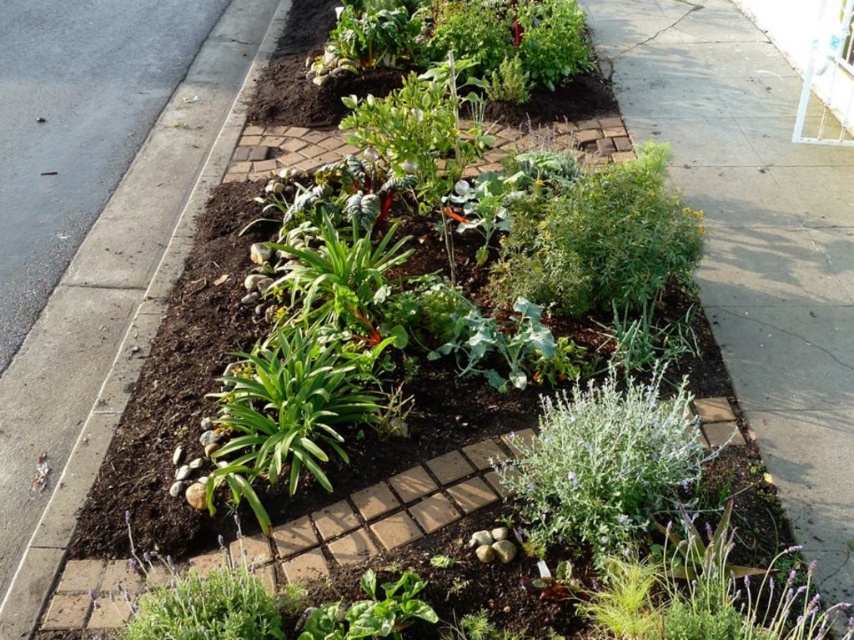
Question: Which point is farther from the camera taking this photo?

Choices:
 (A) (220, 406)
 (B) (753, 330)
 (C) (118, 1)

Answer: (C)

Question: Which point is closer to the camera taking this photo?

Choices:
 (A) (249, 371)
 (B) (572, 525)
 (C) (0, 317)

Answer: (B)

Question: Is gray asphalt at lower left further to camera compared to silvery-green leafy plant at lower right?

Choices:
 (A) no
 (B) yes

Answer: (B)

Question: Which object is closer to the camera taking this photo?

Choices:
 (A) green leafy plant at lower right
 (B) gray asphalt at lower left
 (C) silvery-green leafy plant at lower right

Answer: (C)

Question: Can you confirm if silvery-green leafy plant at lower right is thinner than green leafy plant at center?

Choices:
 (A) yes
 (B) no

Answer: (B)

Question: Does gray asphalt at lower left have a larger size compared to green leafy plant at center?

Choices:
 (A) no
 (B) yes

Answer: (B)